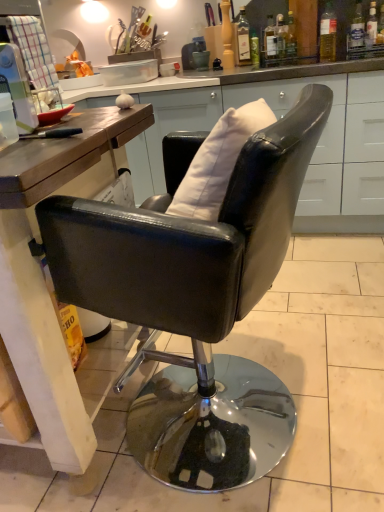
Question: Does white matte pillow at center have a smaller size compared to translucent glass bottle at upper center, which appears as the eighth bottle when viewed from the right?

Choices:
 (A) no
 (B) yes

Answer: (A)

Question: From the image's perspective, is white matte pillow at center over translucent glass bottle at upper center, acting as the 1th bottle starting from the left?

Choices:
 (A) yes
 (B) no

Answer: (B)

Question: Is white matte pillow at center behind translucent glass bottle at upper center, which appears as the eighth bottle when viewed from the right?

Choices:
 (A) yes
 (B) no

Answer: (B)

Question: Is white matte pillow at center turned away from translucent glass bottle at upper center, which appears as the eighth bottle when viewed from the right?

Choices:
 (A) yes
 (B) no

Answer: (B)

Question: From the image's perspective, does white matte pillow at center appear lower than translucent glass bottle at upper center, acting as the 1th bottle starting from the left?

Choices:
 (A) no
 (B) yes

Answer: (B)

Question: Can you confirm if white matte pillow at center is wider than translucent glass bottle at upper center, which appears as the eighth bottle when viewed from the right?

Choices:
 (A) no
 (B) yes

Answer: (B)

Question: Does plastic container at left have a lesser height compared to metallic silver plate at upper center?

Choices:
 (A) yes
 (B) no

Answer: (B)

Question: From the image's perspective, is plastic container at left over metallic silver plate at upper center?

Choices:
 (A) yes
 (B) no

Answer: (B)

Question: Is plastic container at left positioned with its back to metallic silver plate at upper center?

Choices:
 (A) no
 (B) yes

Answer: (A)

Question: Is metallic silver plate at upper center inside plastic container at left?

Choices:
 (A) yes
 (B) no

Answer: (B)

Question: Does plastic container at left have a smaller size compared to metallic silver plate at upper center?

Choices:
 (A) yes
 (B) no

Answer: (A)

Question: From a real-world perspective, does plastic container at left sit lower than metallic silver plate at upper center?

Choices:
 (A) no
 (B) yes

Answer: (A)

Question: From the image's perspective, is clear glass bottle at upper right, which ranks as the seventh bottle in left-to-right order, below black leather chair at center?

Choices:
 (A) yes
 (B) no

Answer: (B)